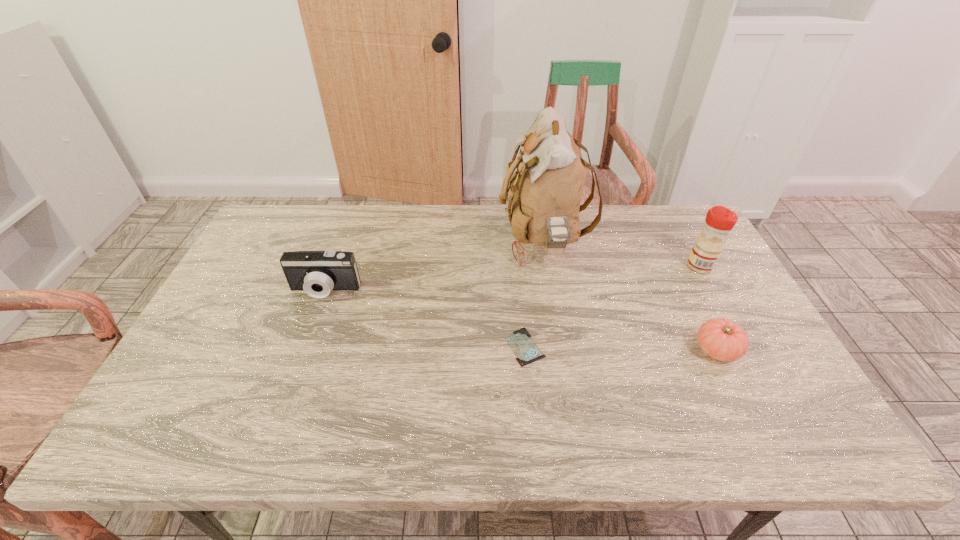
Find the location of a particular element. free region at the far left corner is located at coordinates (272, 211).

Locate an element on the screen. The width and height of the screenshot is (960, 540). vacant point at the far right corner is located at coordinates (678, 217).

Locate an element on the screen. empty location between the camcorder and the identity card is located at coordinates (425, 319).

This screenshot has width=960, height=540. Find the location of `vacant point located between the tomato and the fourth shortest object`. vacant point located between the tomato and the fourth shortest object is located at coordinates (708, 308).

This screenshot has width=960, height=540. I want to click on empty space between the shortest object and the tallest object, so click(x=534, y=295).

You are a GUI agent. You are given a task and a screenshot of the screen. Output one action in this format:
    pyautogui.click(x=<x>, y=<y>)
    Task: Click on the free point between the leftmost object and the condiment
    
    Given the screenshot: What is the action you would take?
    pyautogui.click(x=513, y=278)

The height and width of the screenshot is (540, 960). I want to click on free area in between the tomato and the identity card, so click(621, 348).

Where is `free space between the shortest object and the leftmost object`? Image resolution: width=960 pixels, height=540 pixels. free space between the shortest object and the leftmost object is located at coordinates (425, 319).

I want to click on free space between the tomato and the second tallest object, so click(x=708, y=308).

Identify the location of free spot between the condiment and the tomato. This screenshot has height=540, width=960. (708, 308).